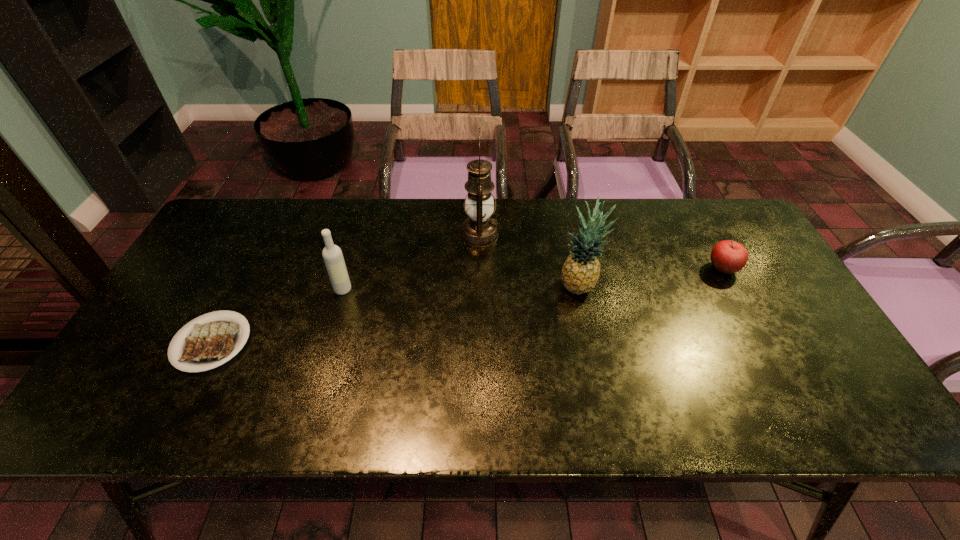
Find the location of a particular element. The image size is (960, 540). free spot between the vodka and the tallest object is located at coordinates (411, 262).

Identify the location of free point between the third tallest object and the second shortest object. The image size is (960, 540). (533, 279).

Identify the location of the second closest object relative to the third shortest object. (479, 230).

Locate an element on the screen. This screenshot has height=540, width=960. object that stands as the third closest to the fourth tallest object is located at coordinates (333, 258).

Where is `free point that satisfies the following two spatial constraints: 1. on the front side of the second shortest object; 2. on the left side of the oil lamp`? The image size is (960, 540). free point that satisfies the following two spatial constraints: 1. on the front side of the second shortest object; 2. on the left side of the oil lamp is located at coordinates (480, 268).

The width and height of the screenshot is (960, 540). Find the location of `free space that satisfies the following two spatial constraints: 1. on the back side of the third tallest object; 2. on the left side of the second tallest object`. free space that satisfies the following two spatial constraints: 1. on the back side of the third tallest object; 2. on the left side of the second tallest object is located at coordinates (344, 287).

Where is `vacant space that satisfies the following two spatial constraints: 1. on the back side of the apple; 2. on the right side of the plate`? The width and height of the screenshot is (960, 540). vacant space that satisfies the following two spatial constraints: 1. on the back side of the apple; 2. on the right side of the plate is located at coordinates (250, 268).